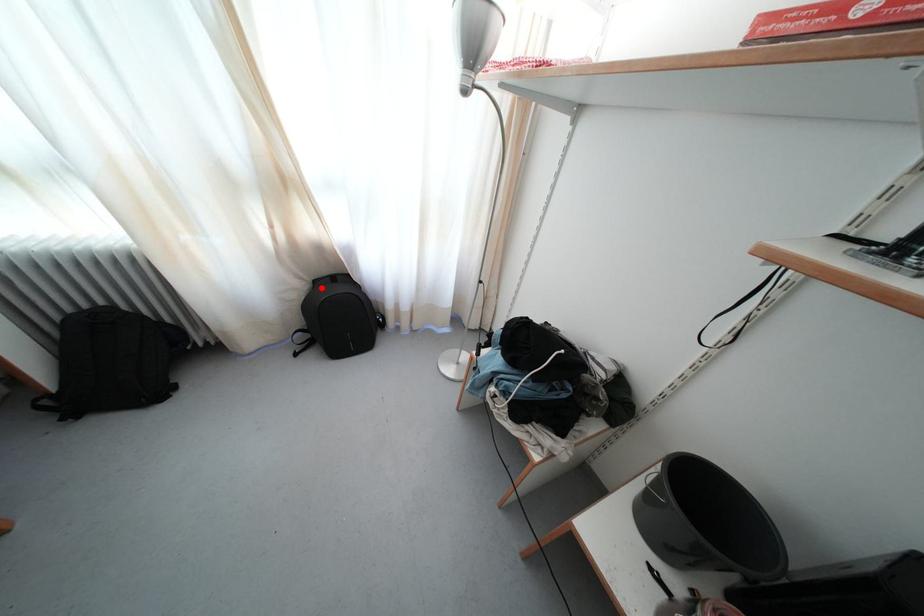
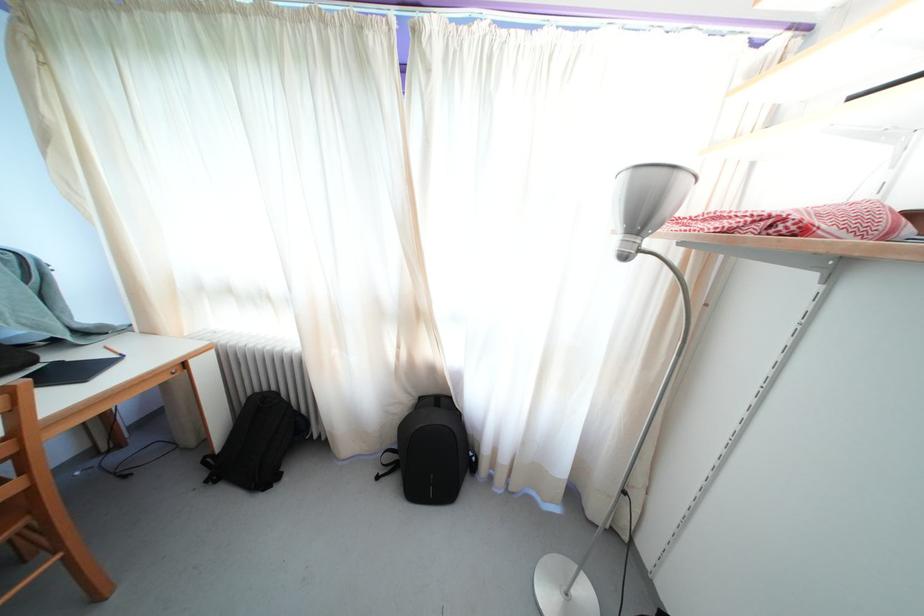
Find the pixel in the second image that matches the highlighted location in the first image.

(427, 405)